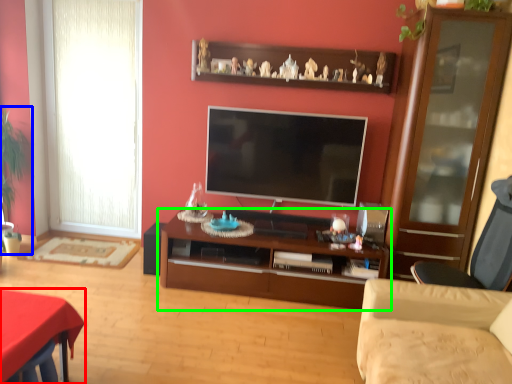
Question: Which object is the farthest from desk (highlighted by a red box)? Choose among these: plant (highlighted by a blue box) or cabinetry (highlighted by a green box).

Choices:
 (A) plant
 (B) cabinetry

Answer: (A)